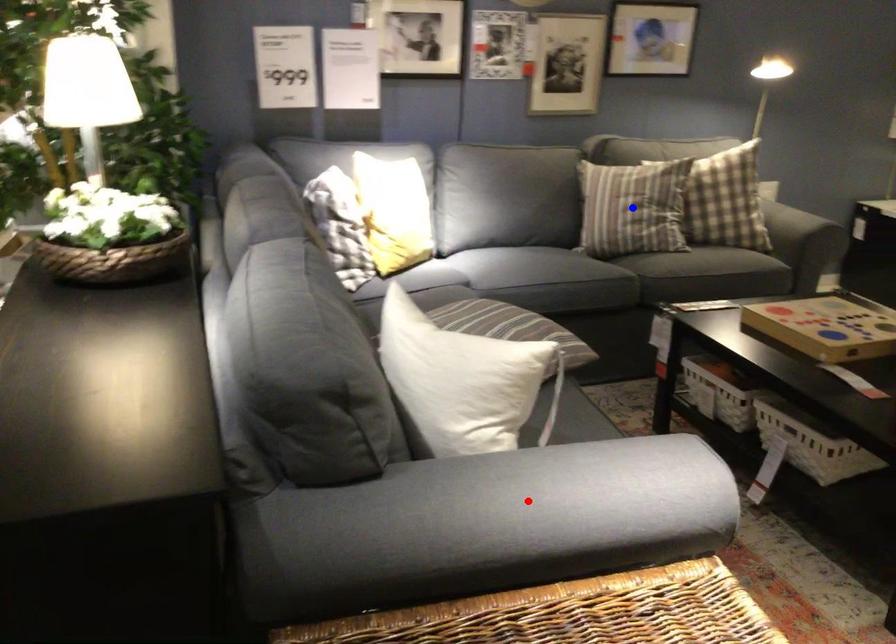
Question: In the image, two points are highlighted. Which point is nearer to the camera? Reply with the corresponding letter.

Choices:
 (A) blue point
 (B) red point

Answer: (B)